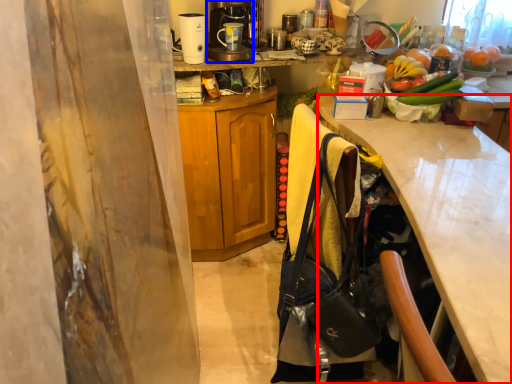
Question: Which object appears closest to the camera in this image, desk (highlighted by a red box) or coffee maker (highlighted by a blue box)?

Choices:
 (A) desk
 (B) coffee maker

Answer: (A)